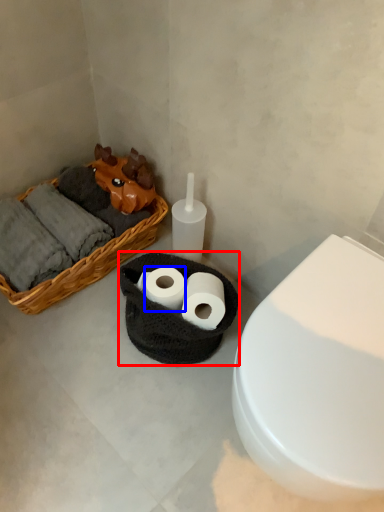
Question: Which object is closer to the camera taking this photo, basket container (highlighted by a red box) or toilet paper (highlighted by a blue box)?

Choices:
 (A) basket container
 (B) toilet paper

Answer: (A)